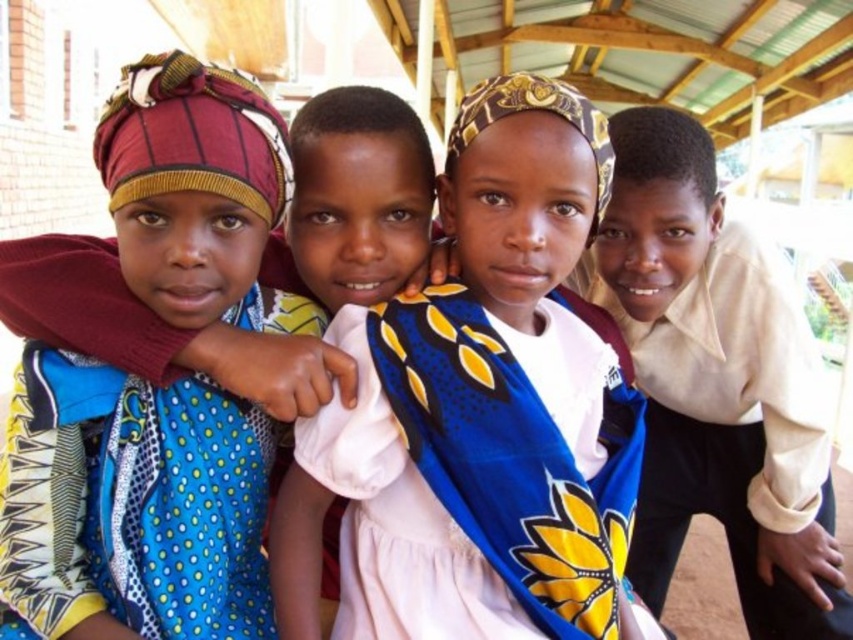
Is polka dot fabric dress at center to the left of light beige shirt at right from the viewer's perspective?

Indeed, polka dot fabric dress at center is positioned on the left side of light beige shirt at right.

Who is positioned more to the left, polka dot fabric dress at center or light beige shirt at right?

polka dot fabric dress at center is more to the left.

Consider the image. Who is more distant from viewer, [161,554] or [788,300]?

The point [788,300] is behind.

Identify the location of polka dot fabric dress at center. (132, 506).

Is blue printed fabric at center above polka dot fabric dress at center?

Incorrect, blue printed fabric at center is not positioned above polka dot fabric dress at center.

Is blue printed fabric at center taller than polka dot fabric dress at center?

Correct, blue printed fabric at center is much taller as polka dot fabric dress at center.

You are a GUI agent. You are given a task and a screenshot of the screen. Output one action in this format:
    pyautogui.click(x=<x>, y=<y>)
    Task: Click on the blue printed fabric at center
    
    Given the screenshot: What is the action you would take?
    pyautogui.click(x=479, y=413)

Locate an element on the screen. This screenshot has height=640, width=853. blue printed fabric at center is located at coordinates (479, 413).

Does blue printed fabric at center appear under light beige shirt at right?

Actually, blue printed fabric at center is above light beige shirt at right.

Which is more to the right, blue printed fabric at center or light beige shirt at right?

light beige shirt at right is more to the right.

Between point (543, 468) and point (735, 426), which one is positioned in front?

Positioned in front is point (543, 468).

Identify the location of blue printed fabric at center. This screenshot has height=640, width=853. (479, 413).